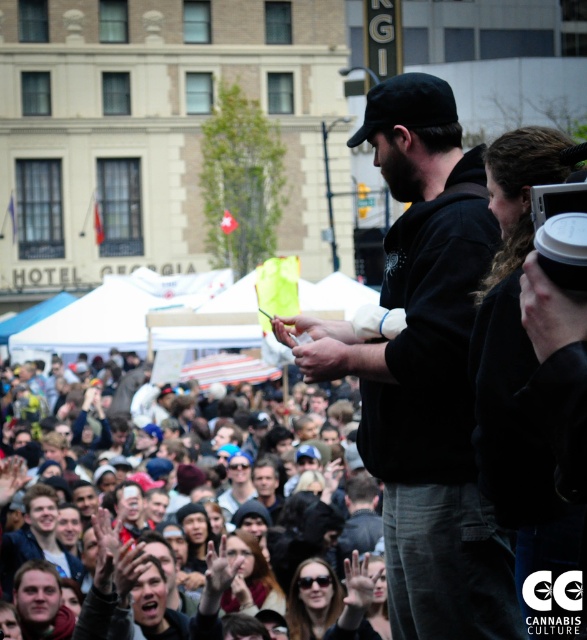
From the picture: You are standing in the crowd at the Hotel Georgia event. You notice a person wearing a matte black shirt at center and a blurred crowd at center. From your perspective, which object is positioned to the right of the other?

The blurred crowd at center is to the right of the matte black shirt at center according to the description.